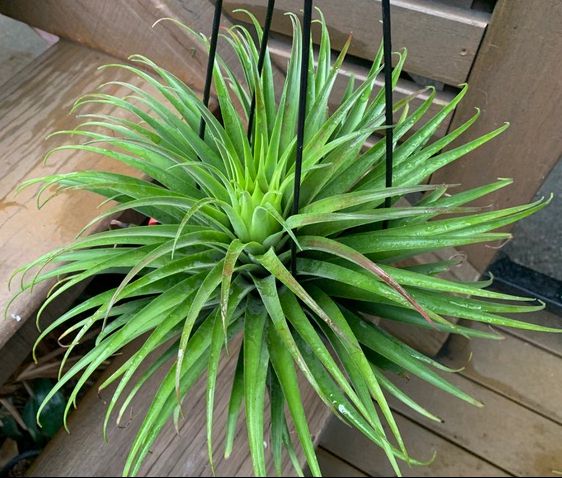
This screenshot has height=478, width=562. Identify the location of doorway. (545, 262).